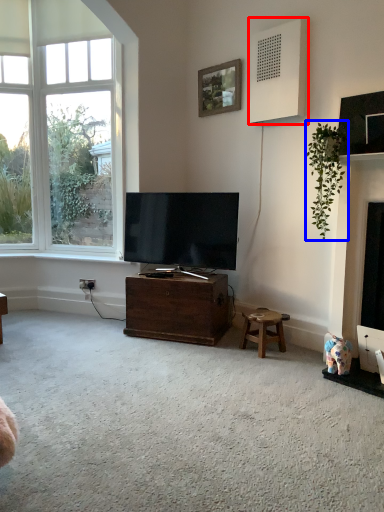
Question: Which point is further to the camera, speaker (highlighted by a red box) or houseplant (highlighted by a blue box)?

Choices:
 (A) speaker
 (B) houseplant

Answer: (A)